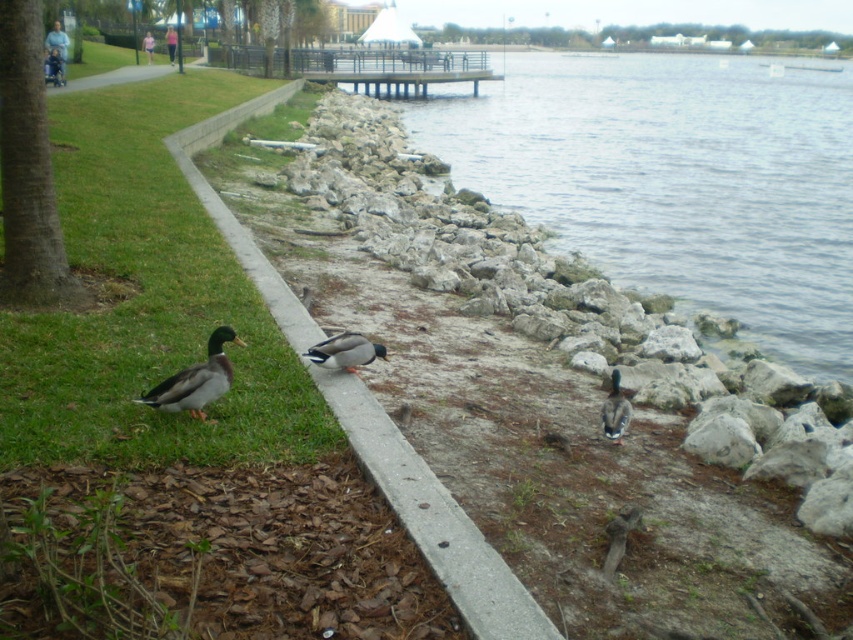
Question: Which of the following is the closest to the observer?

Choices:
 (A) (630, 412)
 (B) (221, 433)

Answer: (B)

Question: Can you confirm if green grass at lower left is smaller than green-feathered duck at center?

Choices:
 (A) yes
 (B) no

Answer: (B)

Question: Estimate the real-world distances between objects in this image. Which object is closer to the green glossy duck at center?

Choices:
 (A) green grass at lower left
 (B) green glossy duck at lower left

Answer: (B)

Question: Which point appears farthest from the camera in this image?

Choices:
 (A) (223, 330)
 (B) (625, 410)

Answer: (B)

Question: Is green glossy duck at lower left above green-feathered duck at center?

Choices:
 (A) no
 (B) yes

Answer: (A)

Question: Is green grass at lower left positioned before green-feathered duck at center?

Choices:
 (A) yes
 (B) no

Answer: (A)